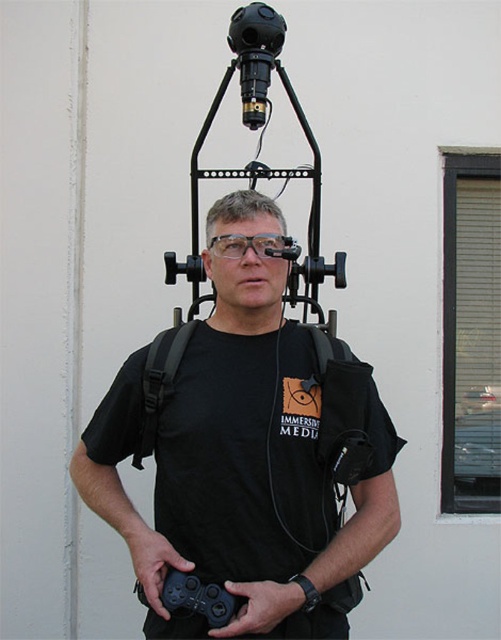
Measure the distance between point (x=228, y=602) and camera.

A distance of 6.21 feet exists between point (x=228, y=602) and camera.

Does point (213, 618) come closer to viewer compared to point (281, 252)?

Yes.

The width and height of the screenshot is (501, 640). Identify the location of black matte game controller at lower center. (198, 598).

Between black fabric strap at upper center and transparent plastic glasses at center, which one has more height?

Standing taller between the two is black fabric strap at upper center.

Is black fabric strap at upper center to the right of transparent plastic glasses at center from the viewer's perspective?

No, black fabric strap at upper center is not to the right of transparent plastic glasses at center.

Is point (157, 353) positioned behind point (236, 257)?

Yes, point (157, 353) is behind point (236, 257).

Find the location of a particular element. The image size is (501, 640). black fabric strap at upper center is located at coordinates (159, 381).

Between point (171, 589) and point (225, 637), which one is positioned in front?

Point (225, 637) is more forward.

Between black matte game controller at lower center and black matte game controller at center, which one appears on the right side from the viewer's perspective?

black matte game controller at center

The height and width of the screenshot is (640, 501). I want to click on black matte game controller at lower center, so click(198, 598).